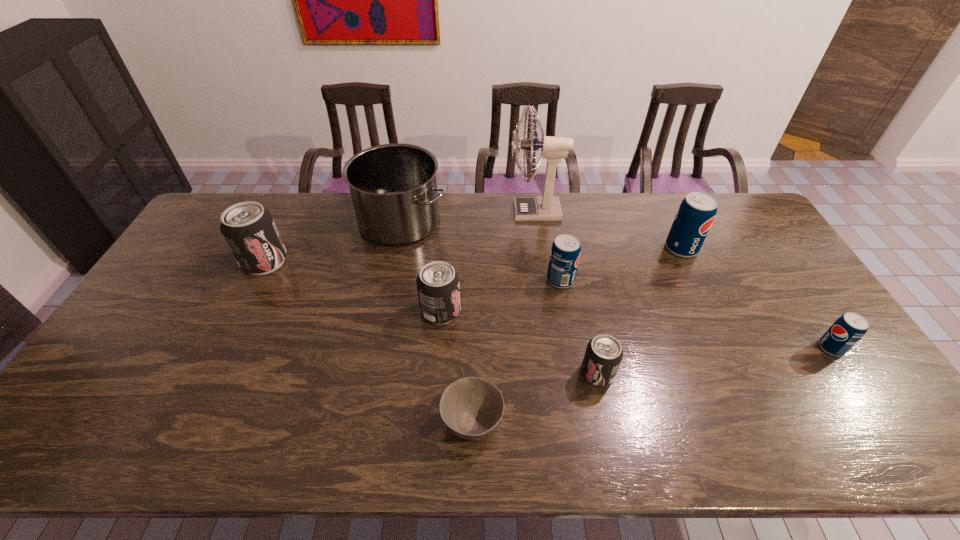
What are the coordinates of `the second black soda can from right to left` in the screenshot? It's located at (438, 286).

I want to click on the rightmost object, so click(848, 329).

The image size is (960, 540). I want to click on the third nearest object, so click(x=848, y=329).

Identify the location of the nearest black soda can. The image size is (960, 540). (603, 355).

The height and width of the screenshot is (540, 960). In order to click on the nearest soda can in this screenshot , I will do `click(603, 355)`.

The height and width of the screenshot is (540, 960). I want to click on the shortest object, so click(471, 408).

Locate an element on the screen. The width and height of the screenshot is (960, 540). bowl is located at coordinates (471, 408).

Image resolution: width=960 pixels, height=540 pixels. I want to click on vacant space located 0.220m on the front-facing side of the blue fan, so click(449, 211).

This screenshot has height=540, width=960. I want to click on free spot located on the front-facing side of the blue fan, so click(x=492, y=211).

This screenshot has width=960, height=540. Find the location of `vacant space located 0.280m on the front-facing side of the blue fan`. vacant space located 0.280m on the front-facing side of the blue fan is located at coordinates (432, 211).